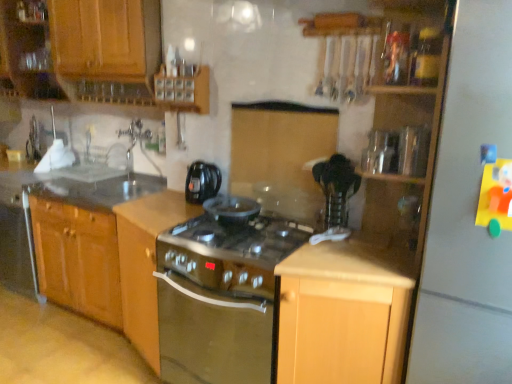
Question: Considering the relative positions of light wood cabinet at center, the 4th cabinetry when ordered from left to right, and black plastic kettle at center in the image provided, is light wood cabinet at center, the 4th cabinetry when ordered from left to right, to the left of black plastic kettle at center from the viewer's perspective?

Choices:
 (A) no
 (B) yes

Answer: (A)

Question: Is black plastic kettle at center at the back of light wood cabinet at center, the first cabinetry in the right-to-left sequence?

Choices:
 (A) no
 (B) yes

Answer: (A)

Question: Is light wood cabinet at center, the 4th cabinetry when ordered from left to right, outside black plastic kettle at center?

Choices:
 (A) no
 (B) yes

Answer: (B)

Question: Can you confirm if light wood cabinet at center, the 4th cabinetry when ordered from left to right, is wider than black plastic kettle at center?

Choices:
 (A) no
 (B) yes

Answer: (B)

Question: Does light wood cabinet at center, the first cabinetry in the right-to-left sequence, have a larger size compared to black plastic kettle at center?

Choices:
 (A) yes
 (B) no

Answer: (A)

Question: Could you tell me if light wood cabinet at center, the first cabinetry in the right-to-left sequence, is turned towards black plastic kettle at center?

Choices:
 (A) no
 (B) yes

Answer: (A)

Question: Is wooden cabinet at upper left, positioned as the first cabinetry in left-to-right order, outside of smooth granite countertop at left?

Choices:
 (A) yes
 (B) no

Answer: (A)

Question: Considering the relative sizes of wooden cabinet at upper left, which is the fourth cabinetry in right-to-left order, and smooth granite countertop at left in the image provided, is wooden cabinet at upper left, which is the fourth cabinetry in right-to-left order, smaller than smooth granite countertop at left?

Choices:
 (A) no
 (B) yes

Answer: (A)

Question: From a real-world perspective, is wooden cabinet at upper left, which is the fourth cabinetry in right-to-left order, located beneath smooth granite countertop at left?

Choices:
 (A) yes
 (B) no

Answer: (B)

Question: Is wooden cabinet at upper left, which is the fourth cabinetry in right-to-left order, positioned with its back to smooth granite countertop at left?

Choices:
 (A) no
 (B) yes

Answer: (A)

Question: Considering the relative positions of wooden cabinet at upper left, positioned as the first cabinetry in left-to-right order, and smooth granite countertop at left in the image provided, is wooden cabinet at upper left, positioned as the first cabinetry in left-to-right order, to the right of smooth granite countertop at left from the viewer's perspective?

Choices:
 (A) no
 (B) yes

Answer: (A)

Question: Considering the relative sizes of wooden cabinet at upper left, positioned as the first cabinetry in left-to-right order, and smooth granite countertop at left in the image provided, is wooden cabinet at upper left, positioned as the first cabinetry in left-to-right order, bigger than smooth granite countertop at left?

Choices:
 (A) yes
 (B) no

Answer: (A)

Question: Considering the relative positions of white matte refrigerator at right and satin silver oven at center in the image provided, is white matte refrigerator at right to the right of satin silver oven at center from the viewer's perspective?

Choices:
 (A) no
 (B) yes

Answer: (B)